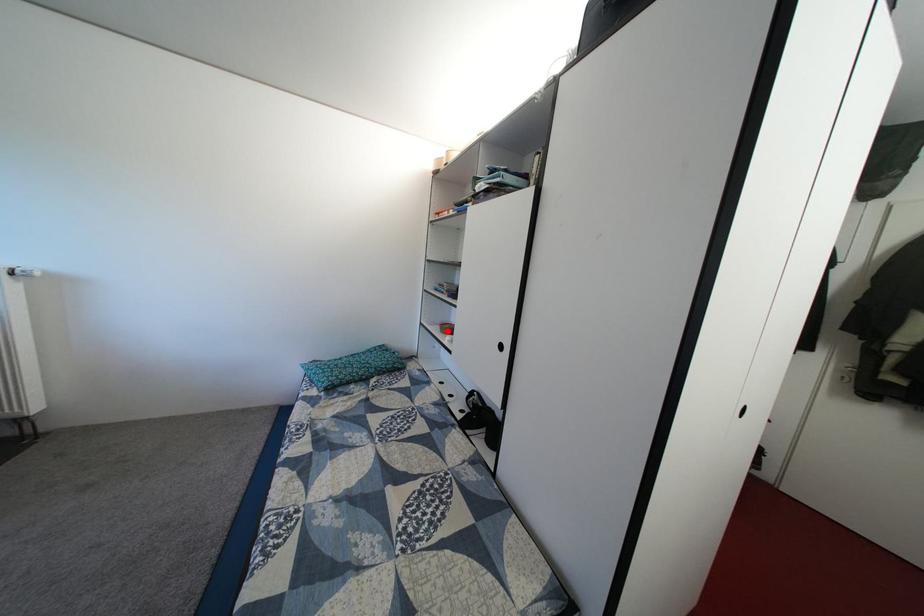
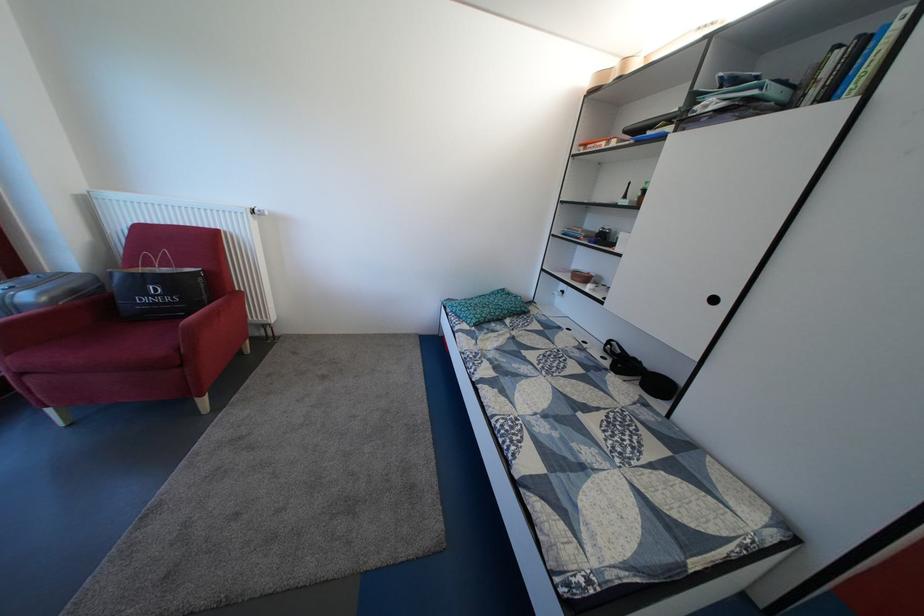
Question: I am providing you with two images of the same scene from different viewpoints. In image1, a red point is highlighted. Considering the same 3D point in image2, which of the following is correct?

Choices:
 (A) It is closer
 (B) It is farther

Answer: (A)